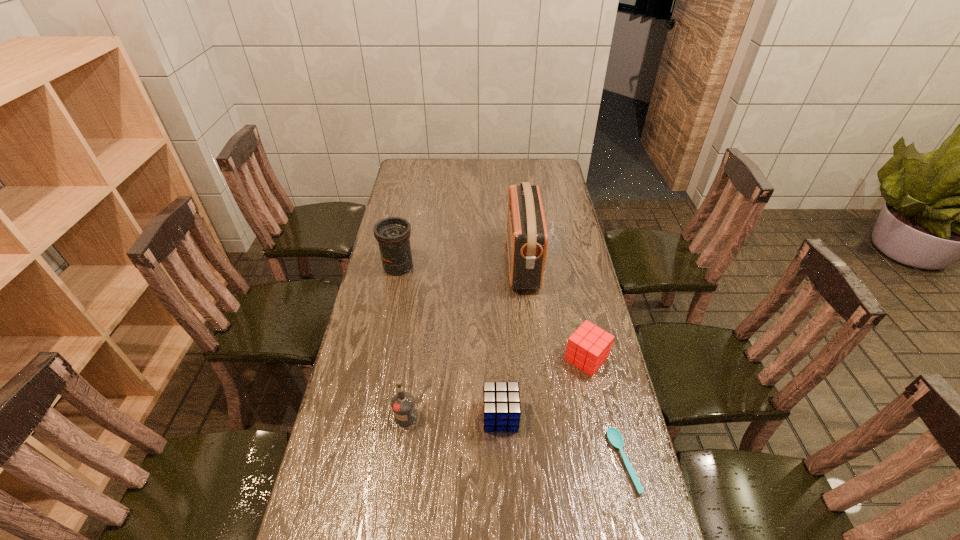
Find the location of a particular element. The image size is (960, 540). vacant area between the telephoto lens and the left cube is located at coordinates (449, 341).

The image size is (960, 540). Identify the location of empty space between the leftmost object and the radio receiver. (461, 265).

The image size is (960, 540). Identify the location of blank region between the spoon and the farther cube. (605, 409).

This screenshot has width=960, height=540. Identify the location of object that stands as the fifth closest to the fourth object from right to left. (393, 234).

I want to click on object that is the fourth nearest to the left cube, so click(527, 238).

You are a GUI agent. You are given a task and a screenshot of the screen. Output one action in this format:
    pyautogui.click(x=<x>, y=<y>)
    Task: Click on the free spot that satisfies the following two spatial constraints: 1. on the front-facing side of the radio receiver; 2. on the front side of the leftmost object
    Image resolution: width=960 pixels, height=540 pixels.
    Given the screenshot: What is the action you would take?
    pyautogui.click(x=523, y=266)

Image resolution: width=960 pixels, height=540 pixels. Find the location of `vacant space that satisfies the following two spatial constraints: 1. on the front label of the second object from left to right; 2. on the right side of the spoon`. vacant space that satisfies the following two spatial constraints: 1. on the front label of the second object from left to right; 2. on the right side of the spoon is located at coordinates (400, 461).

Identify the location of free space that satisfies the following two spatial constraints: 1. on the front-facing side of the spoon; 2. on the left side of the tallest object. click(544, 461).